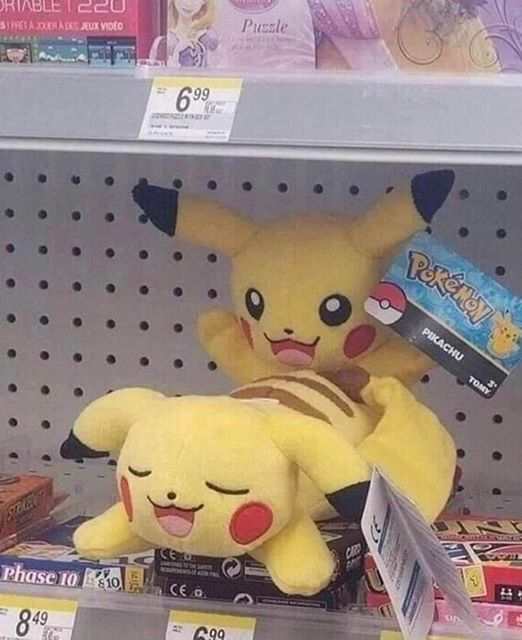
You are a GUI agent. You are given a task and a screenshot of the screen. Output one action in this format:
    pyautogui.click(x=<x>, y=<y>)
    Task: Click on the stuffed toy
    Image resolution: width=522 pixels, height=640 pixels.
    Given the screenshot: What is the action you would take?
    pyautogui.click(x=257, y=450), pyautogui.click(x=314, y=290)